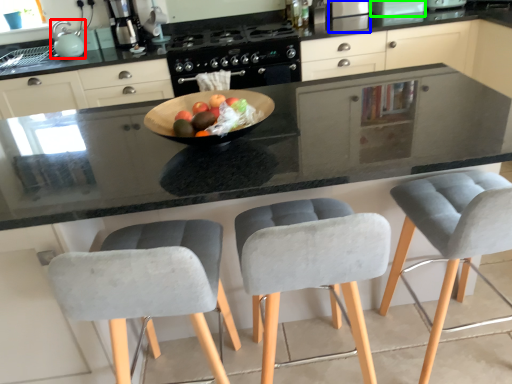
Question: Estimate the real-world distances between objects in this image. Which object is farther from appliance (highlighted by a red box), appliance (highlighted by a blue box) or appliance (highlighted by a green box)?

Choices:
 (A) appliance
 (B) appliance

Answer: (B)